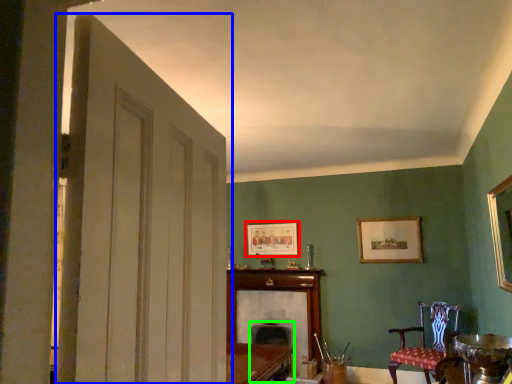
Question: Considering the real-world distances, which object is farthest from picture frame (highlighted by a red box)? door (highlighted by a blue box) or swivel chair (highlighted by a green box)?

Choices:
 (A) door
 (B) swivel chair

Answer: (A)